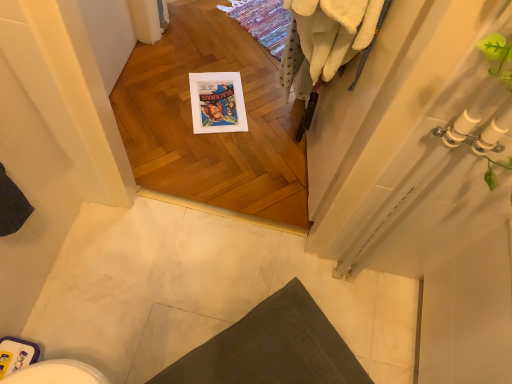
The width and height of the screenshot is (512, 384). What do you see at coordinates (272, 348) in the screenshot?
I see `dark gray fabric bath mat at lower center` at bounding box center [272, 348].

Locate an element on the screen. The image size is (512, 384). dark gray fabric bath mat at lower center is located at coordinates (272, 348).

Describe the element at coordinates (325, 38) in the screenshot. I see `white fluffy bath towel at upper right` at that location.

Measure the distance between point (331, 4) and camera.

Point (331, 4) and camera are 83.50 centimeters apart from each other.

In order to click on white fluffy bath towel at upper right in this screenshot , I will do `click(325, 38)`.

Identify the location of dark gray fabric bath mat at lower center. [272, 348].

In the scene shown: Does white fluffy bath towel at upper right appear on the left side of dark gray fabric bath mat at lower center?

Incorrect, white fluffy bath towel at upper right is not on the left side of dark gray fabric bath mat at lower center.

Is white fluffy bath towel at upper right closer to camera compared to dark gray fabric bath mat at lower center?

Yes, white fluffy bath towel at upper right is in front of dark gray fabric bath mat at lower center.

Is point (300, 96) less distant than point (260, 353)?

No, it is not.

From the image's perspective, is white fluffy bath towel at upper right below dark gray fabric bath mat at lower center?

Actually, white fluffy bath towel at upper right appears above dark gray fabric bath mat at lower center in the image.

From a real-world perspective, is white fluffy bath towel at upper right above or below dark gray fabric bath mat at lower center?

Clearly, from a real-world perspective, white fluffy bath towel at upper right is above dark gray fabric bath mat at lower center.

Is white fluffy bath towel at upper right wider than dark gray fabric bath mat at lower center?

No, white fluffy bath towel at upper right is not wider than dark gray fabric bath mat at lower center.

Which of these two, white fluffy bath towel at upper right or dark gray fabric bath mat at lower center, stands taller?

Standing taller between the two is white fluffy bath towel at upper right.

Does white fluffy bath towel at upper right have a larger size compared to dark gray fabric bath mat at lower center?

Correct, white fluffy bath towel at upper right is larger in size than dark gray fabric bath mat at lower center.

Can dark gray fabric bath mat at lower center be found inside white fluffy bath towel at upper right?

No.

Is there a large distance between white fluffy bath towel at upper right and dark gray fabric bath mat at lower center?

white fluffy bath towel at upper right is near dark gray fabric bath mat at lower center, not far away.

Is white fluffy bath towel at upper right aimed at dark gray fabric bath mat at lower center?

No, white fluffy bath towel at upper right is not aimed at dark gray fabric bath mat at lower center.

Where is `bath towel that appears in front of the dark gray fabric bath mat at lower center`? The image size is (512, 384). bath towel that appears in front of the dark gray fabric bath mat at lower center is located at coordinates (325, 38).

Can you confirm if dark gray fabric bath mat at lower center is positioned to the left of white fluffy bath towel at upper right?

Correct, you'll find dark gray fabric bath mat at lower center to the left of white fluffy bath towel at upper right.

Which object is more forward, dark gray fabric bath mat at lower center or white fluffy bath towel at upper right?

white fluffy bath towel at upper right is closer to the camera.

Which is behind, point (309, 378) or point (337, 56)?

The point (309, 378) is more distant.

From the picture: From the image's perspective, is dark gray fabric bath mat at lower center above or below white fluffy bath towel at upper right?

dark gray fabric bath mat at lower center is situated lower than white fluffy bath towel at upper right in the image.

From a real-world perspective, which object rests below the other?

In real-world perspective, dark gray fabric bath mat at lower center is lower.

Based on the photo, which of these two, dark gray fabric bath mat at lower center or white fluffy bath towel at upper right, is thinner?

white fluffy bath towel at upper right.

Between dark gray fabric bath mat at lower center and white fluffy bath towel at upper right, which one has more height?

white fluffy bath towel at upper right.

Does dark gray fabric bath mat at lower center have a larger size compared to white fluffy bath towel at upper right?

No.

From the picture: Is white fluffy bath towel at upper right completely or partially inside dark gray fabric bath mat at lower center?

Actually, white fluffy bath towel at upper right is outside dark gray fabric bath mat at lower center.

Is dark gray fabric bath mat at lower center touching white fluffy bath towel at upper right?

No, dark gray fabric bath mat at lower center is not with white fluffy bath towel at upper right.

Is dark gray fabric bath mat at lower center positioned with its back to white fluffy bath towel at upper right?

No, dark gray fabric bath mat at lower center is not facing away from white fluffy bath towel at upper right.

How distant is dark gray fabric bath mat at lower center from white fluffy bath towel at upper right?

30.12 inches.

Where is `bath mat lying behind the white fluffy bath towel at upper right`? Image resolution: width=512 pixels, height=384 pixels. bath mat lying behind the white fluffy bath towel at upper right is located at coordinates (272, 348).

You are a GUI agent. You are given a task and a screenshot of the screen. Output one action in this format:
    pyautogui.click(x=<x>, y=<y>)
    Task: Click on the bath mat on the left of white fluffy bath towel at upper right
    
    Given the screenshot: What is the action you would take?
    pyautogui.click(x=272, y=348)

Where is `bath towel above the dark gray fabric bath mat at lower center (from the image's perspective)`? The width and height of the screenshot is (512, 384). bath towel above the dark gray fabric bath mat at lower center (from the image's perspective) is located at coordinates (325, 38).